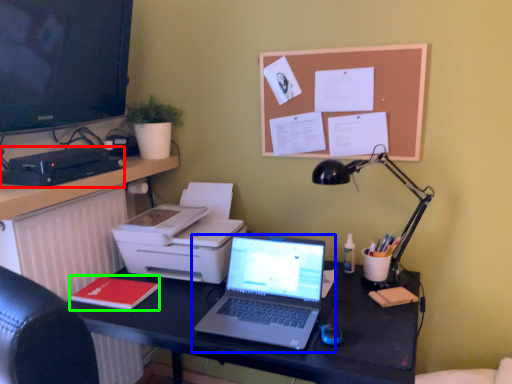
Question: Based on their relative distances, which object is farther from stationery (highlighted by a red box)? Choose from laptop (highlighted by a blue box) and notepad (highlighted by a green box).

Choices:
 (A) laptop
 (B) notepad

Answer: (A)